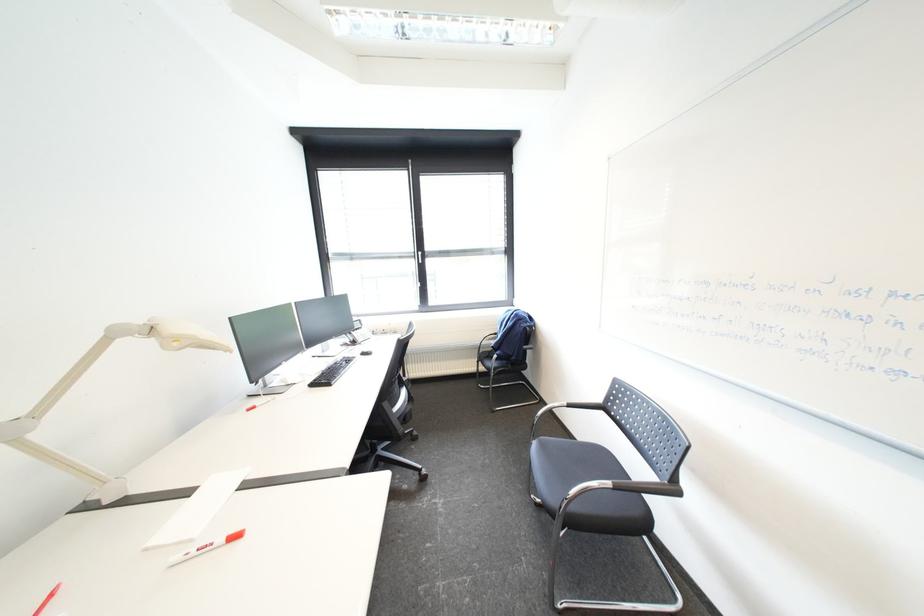
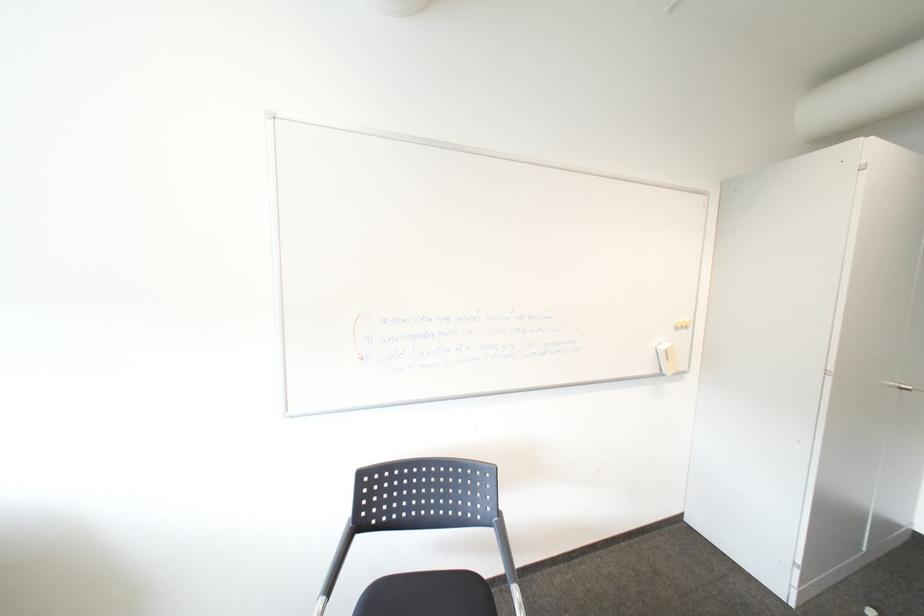
Question: The camera is either moving clockwise (left) or counter-clockwise (right) around the object. The first image is from the beginning of the video and the second image is from the end. Is the camera moving left or right when shooting the video?

Choices:
 (A) Left
 (B) Right

Answer: (A)